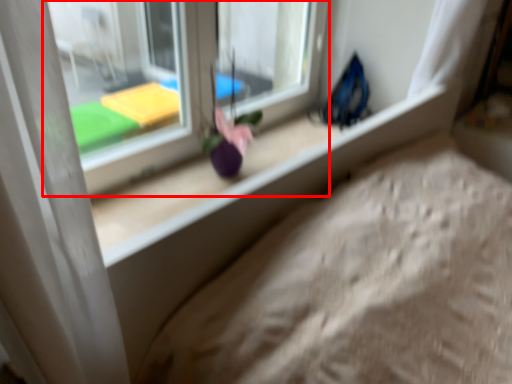
Question: From the image's perspective, considering the relative positions of window (annotated by the red box) and flower in the image provided, where is window (annotated by the red box) located with respect to the staircase?

Choices:
 (A) above
 (B) below

Answer: (A)